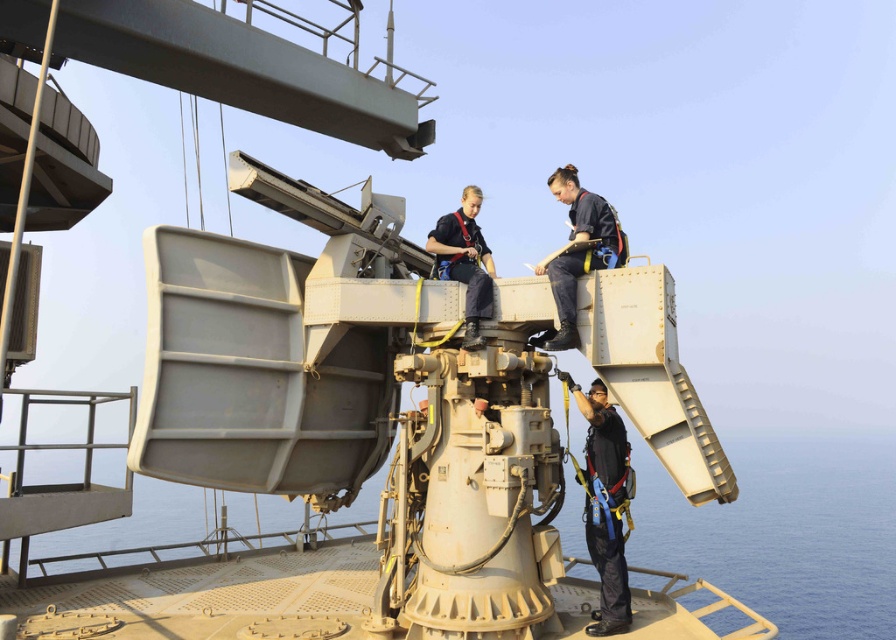
You are a maintenance worker on the ship and need to move from the radar equipment to the camera to check its feed. The camera is located at the edge of the deck. Is the distance between the smooth tan water at lower center and the camera sufficient for you to walk directly there without needing to detour around any obstacles?

The smooth tan water at lower center and the camera are 4.25 meters apart. Since the distance is clear and there are no obstacles mentioned, you can walk directly to the camera.